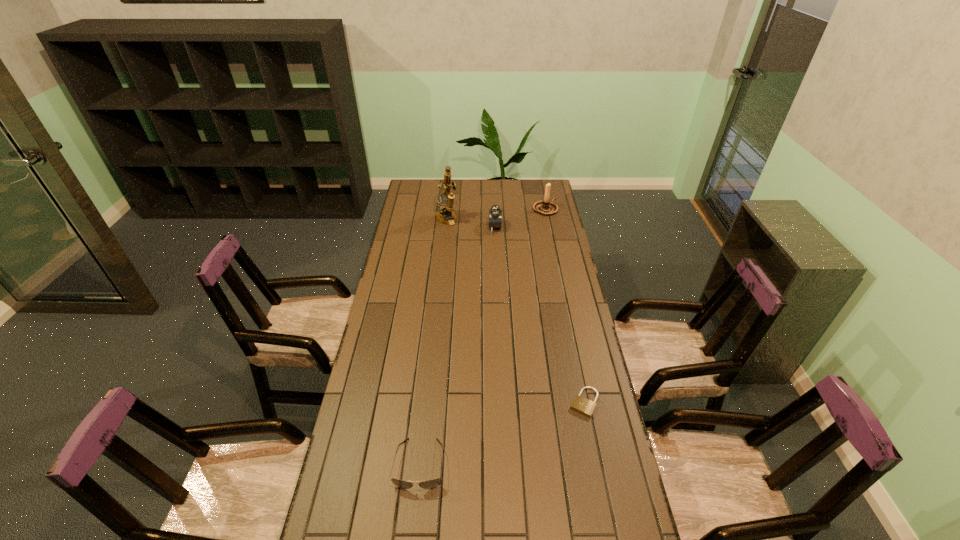
Locate an element on the screen. The width and height of the screenshot is (960, 540). microscope is located at coordinates (446, 208).

Identify the location of candle holder. Image resolution: width=960 pixels, height=540 pixels. (545, 207).

Image resolution: width=960 pixels, height=540 pixels. What are the coordinates of `the third tallest object` in the screenshot? It's located at coord(495,214).

Where is `the third object from right to left`? This screenshot has width=960, height=540. the third object from right to left is located at coordinates (495, 214).

What are the coordinates of `the nearest object` in the screenshot? It's located at (433, 483).

Image resolution: width=960 pixels, height=540 pixels. What are the coordinates of `the second shortest object` in the screenshot? It's located at (433, 483).

At what (x,y) coordinates should I click in order to perform the action: click on padlock. Please return your answer as a coordinate pair (x, y). The width and height of the screenshot is (960, 540). Looking at the image, I should click on click(x=584, y=406).

This screenshot has width=960, height=540. Identify the location of the second nearest object. (584, 406).

This screenshot has height=540, width=960. Find the location of `vacant space located 0.190m on the right of the microscope`. vacant space located 0.190m on the right of the microscope is located at coordinates (495, 219).

You are a GUI agent. You are given a task and a screenshot of the screen. Output one action in this format:
    pyautogui.click(x=<x>, y=<y>)
    Task: Click on the free space located 0.230m on the back of the candle holder
    The height and width of the screenshot is (540, 960).
    Given the screenshot: What is the action you would take?
    pyautogui.click(x=540, y=181)